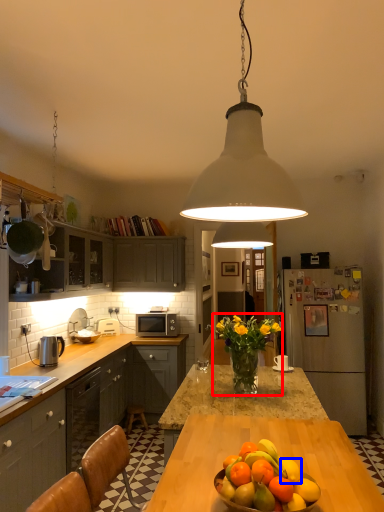
Question: Which point is further to the camera, floral arrangement (highlighted by a red box) or citrus fruit (highlighted by a blue box)?

Choices:
 (A) floral arrangement
 (B) citrus fruit

Answer: (A)